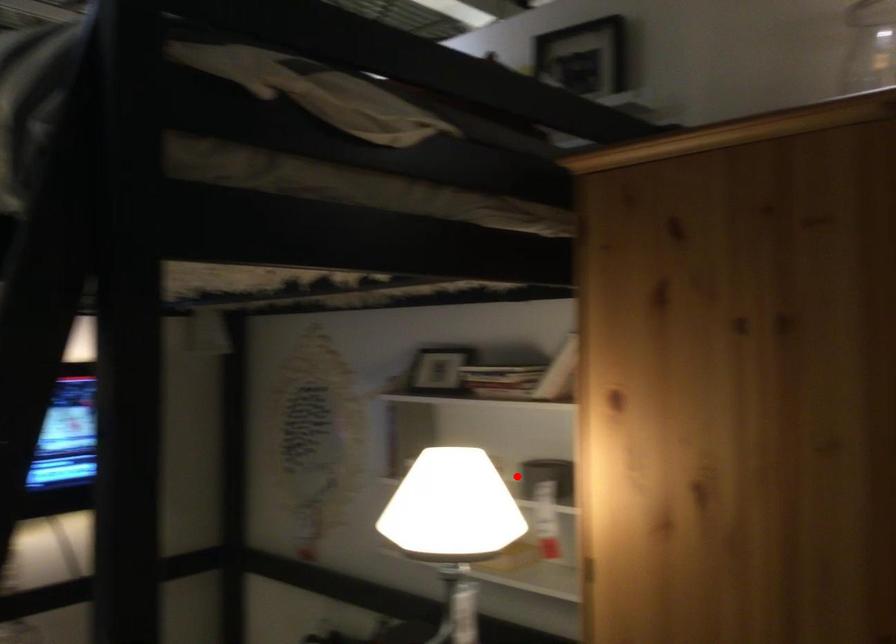
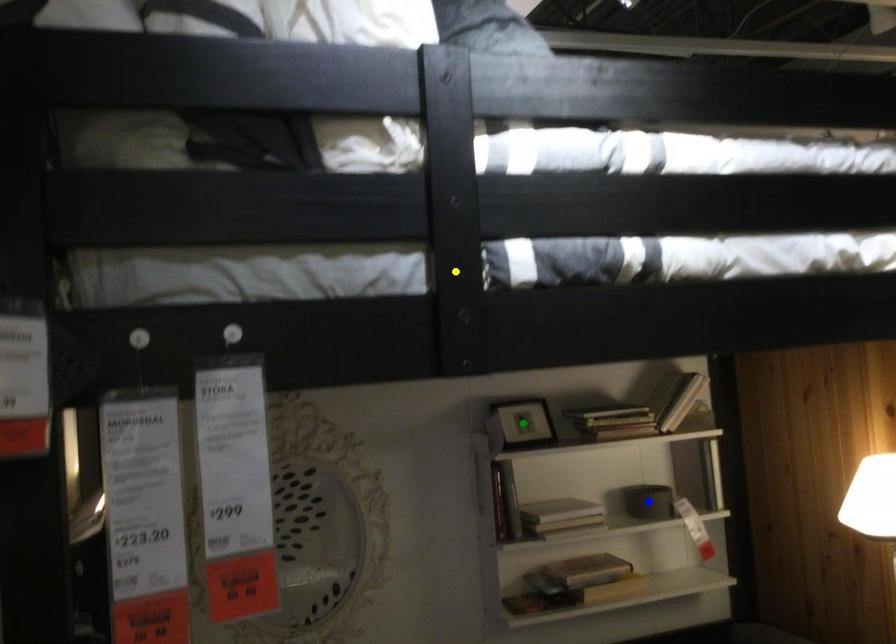
Question: I am providing you with two images of the same scene from different viewpoints. A red point is marked on the first image. You are given multiple points on the second image. Which mark in image 2 goes with the point in image 1?

Choices:
 (A) blue point
 (B) green point
 (C) yellow point

Answer: (A)